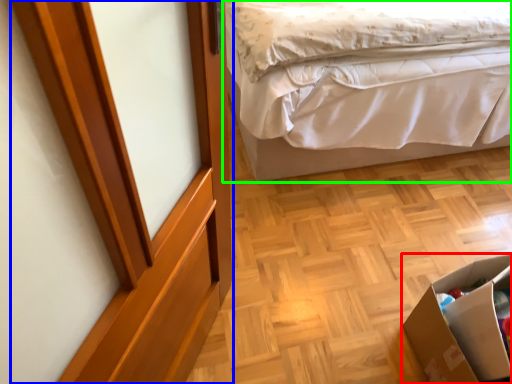
Question: Which object is the closest to the cardboard box (highlighted by a red box)? Choose among these: screen door (highlighted by a blue box) or bed (highlighted by a green box).

Choices:
 (A) screen door
 (B) bed

Answer: (A)